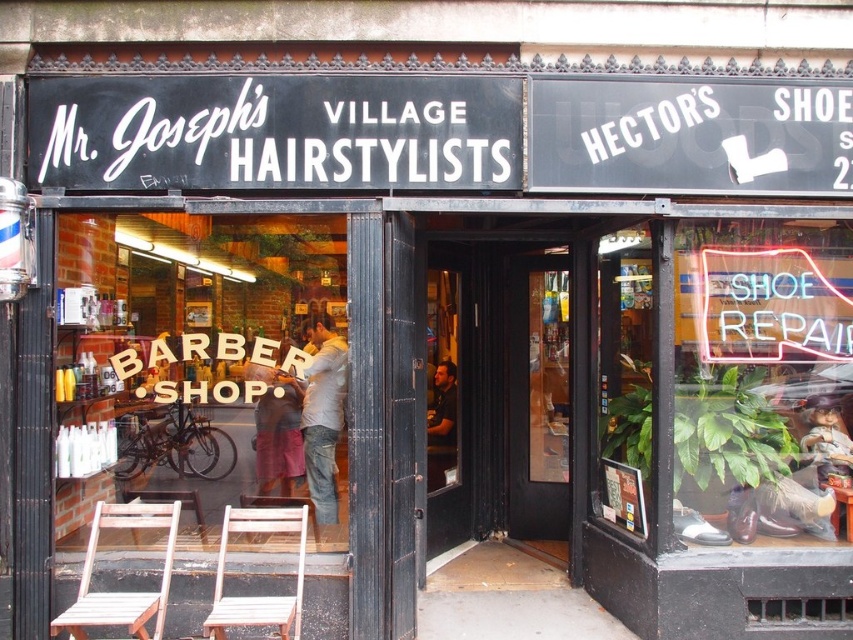
Question: Is light brown wooden chair at lower left bigger than light gray shirt at center?

Choices:
 (A) yes
 (B) no

Answer: (A)

Question: Is light brown wooden chair at lower left positioned before wooden stool at lower right?

Choices:
 (A) no
 (B) yes

Answer: (B)

Question: Which point is closer to the camera?

Choices:
 (A) wooden stool at lower right
 (B) matte plastic doll at center

Answer: (A)

Question: Which point is farther to the camera?

Choices:
 (A) (125, 506)
 (B) (845, 524)
 (C) (850, 465)
 (D) (178, 493)

Answer: (D)

Question: In this image, where is light brown wooden chair at lower left located relative to wooden stool at lower left?

Choices:
 (A) right
 (B) left

Answer: (B)

Question: Which point is closer to the camera?

Choices:
 (A) (296, 444)
 (B) (445, 388)
 (C) (137, 524)

Answer: (C)